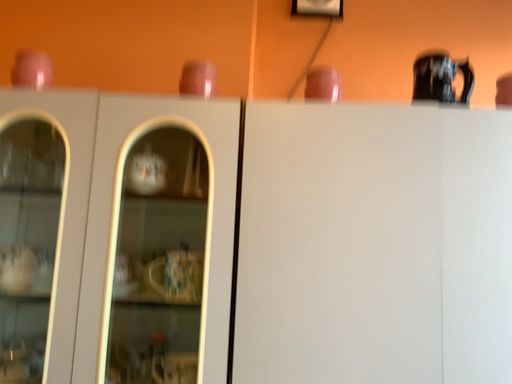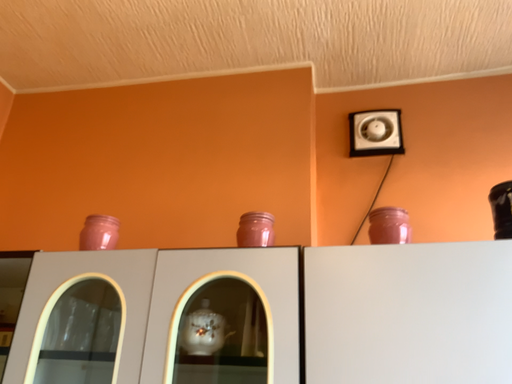
Question: Which way did the camera rotate in the video?

Choices:
 (A) rotated left
 (B) rotated right

Answer: (A)